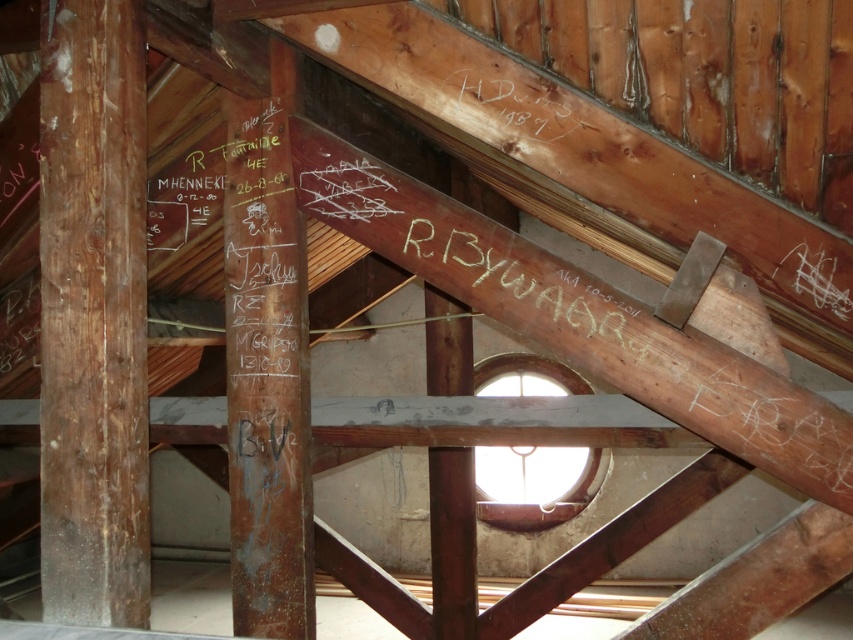
Which is behind, point (65, 400) or point (527, 358)?

Positioned behind is point (527, 358).

Which is in front, point (132, 380) or point (561, 374)?

Point (132, 380)

What do you see at coordinates (93, 314) in the screenshot? The width and height of the screenshot is (853, 640). I see `brown wood pillar at left` at bounding box center [93, 314].

This screenshot has height=640, width=853. Find the location of `brown wood pillar at left`. brown wood pillar at left is located at coordinates (93, 314).

Which is above, transparent glass window at center or black wood writing at upper center?

black wood writing at upper center

Measure the distance between transparent glass window at center and camera.

transparent glass window at center is 6.99 meters from camera.

Where is `transparent glass window at center`? The width and height of the screenshot is (853, 640). transparent glass window at center is located at coordinates (534, 484).

Is brown wood pillar at center closer to camera compared to black wood writing at upper center?

No, it is behind black wood writing at upper center.

Can you confirm if brown wood pillar at center is shorter than black wood writing at upper center?

No.

Between point (282, 282) and point (474, 109), which one is positioned in front?

Point (474, 109)

Where is `brown wood pillar at center`? The image size is (853, 640). brown wood pillar at center is located at coordinates (267, 368).